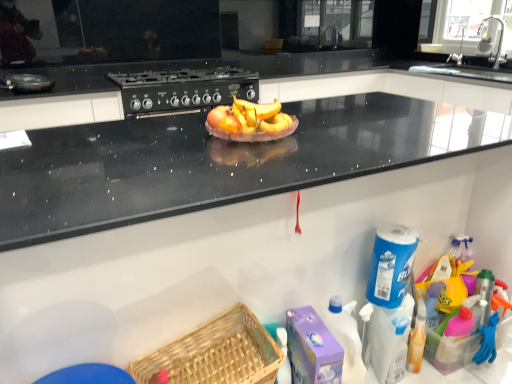
Locate an element on the screen. This screenshot has height=384, width=512. black matte gas stove at upper center is located at coordinates (184, 88).

This screenshot has width=512, height=384. What do you see at coordinates (184, 88) in the screenshot? I see `black matte gas stove at upper center` at bounding box center [184, 88].

Identify the location of yellow matte bananas at center. The image size is (512, 384). (249, 118).

This screenshot has width=512, height=384. I want to click on black matte pan at upper left, so click(x=26, y=83).

Image resolution: width=512 pixels, height=384 pixels. What do you see at coordinates (216, 353) in the screenshot?
I see `woven wood basket at lower center` at bounding box center [216, 353].

You are a GUI agent. You are given a task and a screenshot of the screen. Output one action in this format:
    pyautogui.click(x=<x>, y=<y>)
    Task: Click on the black matte gas stove at upper center
    The height and width of the screenshot is (384, 512).
    Given the screenshot: What is the action you would take?
    click(184, 88)

Can you confirm if silver metallic faucet at upper right, which is the first faucet in back-to-front order, is smaller than black matte pan at upper left?

Indeed, silver metallic faucet at upper right, which is the first faucet in back-to-front order, has a smaller size compared to black matte pan at upper left.

Would you say silver metallic faucet at upper right, placed as the 2th faucet when sorted from front to back, is outside black matte pan at upper left?

Yes, silver metallic faucet at upper right, placed as the 2th faucet when sorted from front to back, is located beyond the bounds of black matte pan at upper left.

At what (x,y) coordinates should I click in order to perform the action: click on appliance that is below the silver metallic faucet at upper right, placed as the 2th faucet when sorted from front to back (from the image's perspective). Please return your answer as a coordinate pair (x, y). Image resolution: width=512 pixels, height=384 pixels. Looking at the image, I should click on (26, 83).

From the image's perspective, is silver metallic faucet at upper right, placed as the 2th faucet when sorted from front to back, above or below black matte pan at upper left?

Clearly, from the image's perspective, silver metallic faucet at upper right, placed as the 2th faucet when sorted from front to back, is above black matte pan at upper left.

Considering the relative positions of metallic faucet at upper right, placed as the 2th faucet when sorted from back to front, and black matte gas stove at upper center in the image provided, is metallic faucet at upper right, placed as the 2th faucet when sorted from back to front, behind black matte gas stove at upper center?

Yes.

Is point (498, 44) positioned behind point (133, 86)?

Yes, it is behind point (133, 86).

Could you measure the distance between metallic faucet at upper right, arranged as the first faucet when viewed from the front, and black matte gas stove at upper center?

metallic faucet at upper right, arranged as the first faucet when viewed from the front, is 7.09 feet from black matte gas stove at upper center.

Is yellow matte bananas at center facing away from metallic faucet at upper right, placed as the 2th faucet when sorted from back to front?

No.

Is yellow matte bananas at center in front of or behind metallic faucet at upper right, arranged as the first faucet when viewed from the front, in the image?

In the image, yellow matte bananas at center appears in front of metallic faucet at upper right, arranged as the first faucet when viewed from the front.

Looking at the image, does yellow matte bananas at center seem bigger or smaller compared to metallic faucet at upper right, placed as the 2th faucet when sorted from back to front?

In the image, yellow matte bananas at center appears to be smaller than metallic faucet at upper right, placed as the 2th faucet when sorted from back to front.

Consider the image. Would you say yellow matte bananas at center contains metallic faucet at upper right, arranged as the first faucet when viewed from the front?

No, metallic faucet at upper right, arranged as the first faucet when viewed from the front, is not surrounded by yellow matte bananas at center.

Locate an element on the screen. The width and height of the screenshot is (512, 384). banana located above the woven wood basket at lower center (from a real-world perspective) is located at coordinates (249, 118).

Would you say yellow matte bananas at center is a long distance from woven wood basket at lower center?

No, yellow matte bananas at center is not far from woven wood basket at lower center.

In terms of width, does yellow matte bananas at center look wider or thinner when compared to woven wood basket at lower center?

Clearly, yellow matte bananas at center has more width compared to woven wood basket at lower center.

From a real-world perspective, between yellow matte bananas at center and woven wood basket at lower center, who is vertically higher?

From a 3D spatial view, yellow matte bananas at center is above.

Is black matte gas stove at upper center surrounded by silver metallic faucet at upper right, placed as the 2th faucet when sorted from front to back?

No, black matte gas stove at upper center is not inside silver metallic faucet at upper right, placed as the 2th faucet when sorted from front to back.

From their relative heights in the image, would you say silver metallic faucet at upper right, placed as the 2th faucet when sorted from front to back, is taller or shorter than black matte gas stove at upper center?

silver metallic faucet at upper right, placed as the 2th faucet when sorted from front to back, is taller than black matte gas stove at upper center.

Considering the positions of point (461, 52) and point (154, 104), is point (461, 52) closer or farther from the camera than point (154, 104)?

Point (461, 52) is farther from the camera than point (154, 104).

How far apart are silver metallic faucet at upper right, placed as the 2th faucet when sorted from front to back, and black matte gas stove at upper center?

silver metallic faucet at upper right, placed as the 2th faucet when sorted from front to back, and black matte gas stove at upper center are 7.10 feet apart from each other.

How many degrees apart are the facing directions of metallic faucet at upper right, placed as the 2th faucet when sorted from back to front, and black matte pan at upper left?

The angular difference between metallic faucet at upper right, placed as the 2th faucet when sorted from back to front, and black matte pan at upper left is 90.6 degrees.

Between metallic faucet at upper right, arranged as the first faucet when viewed from the front, and black matte pan at upper left, which one has larger size?

metallic faucet at upper right, arranged as the first faucet when viewed from the front.

Can black matte pan at upper left be found inside metallic faucet at upper right, placed as the 2th faucet when sorted from back to front?

No, metallic faucet at upper right, placed as the 2th faucet when sorted from back to front, does not contain black matte pan at upper left.

From the image's perspective, would you say metallic faucet at upper right, arranged as the first faucet when viewed from the front, is shown under black matte pan at upper left?

No, from the image's perspective, metallic faucet at upper right, arranged as the first faucet when viewed from the front, is not below black matte pan at upper left.

Which point is more forward, (x=7, y=87) or (x=202, y=328)?

Point (x=202, y=328)

From the image's perspective, would you say black matte pan at upper left is positioned over woven wood basket at lower center?

Yes, from the image's perspective, black matte pan at upper left is over woven wood basket at lower center.

Find the location of a particular element. This screenshot has width=512, height=384. appliance in front of the silver metallic faucet at upper right, placed as the 2th faucet when sorted from front to back is located at coordinates (26, 83).

At what (x,y) coordinates should I click in order to perform the action: click on kitchen appliance that appears below the metallic faucet at upper right, arranged as the first faucet when viewed from the front (from a real-world perspective). Please return your answer as a coordinate pair (x, y). Looking at the image, I should click on (184, 88).

When comparing their distances from metallic faucet at upper right, arranged as the first faucet when viewed from the front, does black matte pan at upper left or yellow matte bananas at center seem further?

The object further to metallic faucet at upper right, arranged as the first faucet when viewed from the front, is black matte pan at upper left.

Based on their spatial positions, is woven wood basket at lower center or black matte gas stove at upper center closer to yellow matte bananas at center?

woven wood basket at lower center lies closer to yellow matte bananas at center than the other object.

Looking at the image, which one is located further to silver metallic faucet at upper right, placed as the 2th faucet when sorted from front to back, black matte pan at upper left or woven wood basket at lower center?

Based on the image, woven wood basket at lower center appears to be further to silver metallic faucet at upper right, placed as the 2th faucet when sorted from front to back.

Based on their spatial positions, is metallic faucet at upper right, placed as the 2th faucet when sorted from back to front, or black matte pan at upper left closer to black matte gas stove at upper center?

black matte pan at upper left is closer to black matte gas stove at upper center.

Looking at the image, which one is located closer to yellow matte bananas at center, black matte pan at upper left or black matte gas stove at upper center?

black matte gas stove at upper center is closer to yellow matte bananas at center.

Considering their positions, is metallic faucet at upper right, arranged as the first faucet when viewed from the front, positioned closer to yellow matte bananas at center than silver metallic faucet at upper right, which is the first faucet in back-to-front order?

The object closer to yellow matte bananas at center is metallic faucet at upper right, arranged as the first faucet when viewed from the front.

From the image, which object appears to be farther from woven wood basket at lower center, yellow matte bananas at center or metallic faucet at upper right, placed as the 2th faucet when sorted from back to front?

metallic faucet at upper right, placed as the 2th faucet when sorted from back to front, is further to woven wood basket at lower center.

From the picture: From the image, which object appears to be nearer to metallic faucet at upper right, placed as the 2th faucet when sorted from back to front, black matte gas stove at upper center or yellow matte bananas at center?

Among the two, black matte gas stove at upper center is located nearer to metallic faucet at upper right, placed as the 2th faucet when sorted from back to front.

Locate an element on the screen. This screenshot has height=384, width=512. basket between black matte gas stove at upper center and metallic faucet at upper right, placed as the 2th faucet when sorted from back to front is located at coordinates (216, 353).

Identify the location of basket between black matte pan at upper left and yellow matte bananas at center in the horizontal direction. The height and width of the screenshot is (384, 512). (216, 353).

The width and height of the screenshot is (512, 384). I want to click on kitchen appliance between black matte pan at upper left and silver metallic faucet at upper right, which is the first faucet in back-to-front order, from left to right, so click(184, 88).

The height and width of the screenshot is (384, 512). I want to click on banana between black matte gas stove at upper center and silver metallic faucet at upper right, which is the first faucet in back-to-front order, from left to right, so click(x=249, y=118).